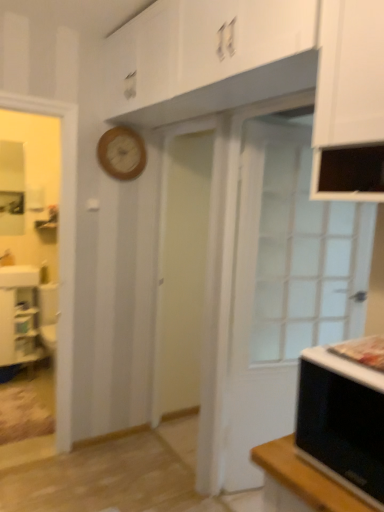
Find the location of `white glass door at right`. white glass door at right is located at coordinates (x=286, y=284).

Describe the element at coordinates (19, 326) in the screenshot. I see `white glossy cabinet at lower left` at that location.

You are a GUI agent. You are given a task and a screenshot of the screen. Output one action in this format:
    pyautogui.click(x=<x>, y=<y>)
    Task: Click on the white glass door at right
    
    Given the screenshot: What is the action you would take?
    pyautogui.click(x=286, y=284)

Based on the photo, between white glossy cabinet at lower left and wooden clock at upper center, which one has less height?

Standing shorter between the two is wooden clock at upper center.

From the image's perspective, does white glossy cabinet at lower left appear lower than wooden clock at upper center?

Yes.

Which object is closer to the camera taking this photo, white glossy cabinet at lower left or wooden clock at upper center?

wooden clock at upper center is in front.

Find the location of `door lying on the right of wooden clock at upper center`. door lying on the right of wooden clock at upper center is located at coordinates (286, 284).

Is white glass door at right positioned far away from wooden clock at upper center?

Yes.

From the image's perspective, is white glass door at right above or below wooden clock at upper center?

white glass door at right is situated lower than wooden clock at upper center in the image.

Considering the sizes of objects white glass door at right and wooden clock at upper center in the image provided, who is shorter, white glass door at right or wooden clock at upper center?

With less height is wooden clock at upper center.

Can you confirm if black matte microwave oven at lower right is smaller than wooden clock at upper center?

No, black matte microwave oven at lower right is not smaller than wooden clock at upper center.

Considering their positions, is black matte microwave oven at lower right located in front of or behind wooden clock at upper center?

In the image, black matte microwave oven at lower right appears in front of wooden clock at upper center.

Would you consider black matte microwave oven at lower right to be distant from wooden clock at upper center?

Indeed, black matte microwave oven at lower right is not near wooden clock at upper center.

From the image's perspective, which object appears higher, black matte microwave oven at lower right or wooden clock at upper center?

wooden clock at upper center, from the image's perspective.

Is white glass door at right positioned in front of white glossy cabinet at lower left?

Yes, white glass door at right is closer to the camera.

Is point (308, 152) positioned before point (25, 353)?

Yes.

You are a GUI agent. You are given a task and a screenshot of the screen. Output one action in this format:
    pyautogui.click(x=<x>, y=<y>)
    Task: Click on the door in front of the white glossy cabinet at lower left
    This screenshot has height=512, width=384.
    Given the screenshot: What is the action you would take?
    pyautogui.click(x=286, y=284)

Is white glass door at right placed right next to white glossy cabinet at lower left?

No, white glass door at right is not beside white glossy cabinet at lower left.

Does black matte microwave oven at lower right have a smaller size compared to white glossy cabinet at lower left?

Indeed, black matte microwave oven at lower right has a smaller size compared to white glossy cabinet at lower left.

The height and width of the screenshot is (512, 384). Find the location of `cabinetry that is under the black matte microwave oven at lower right (from a real-world perspective)`. cabinetry that is under the black matte microwave oven at lower right (from a real-world perspective) is located at coordinates (19, 326).

Considering the sizes of black matte microwave oven at lower right and white glossy cabinet at lower left in the image, is black matte microwave oven at lower right taller or shorter than white glossy cabinet at lower left?

Considering their sizes, black matte microwave oven at lower right has less height than white glossy cabinet at lower left.

From the image's perspective, would you say black matte microwave oven at lower right is shown under white glossy cabinet at lower left?

Actually, black matte microwave oven at lower right appears above white glossy cabinet at lower left in the image.

Does point (136, 135) come farther from viewer compared to point (323, 355)?

Yes, point (136, 135) is farther from viewer.

From a real-world perspective, which is physically below, wooden clock at upper center or black matte microwave oven at lower right?

black matte microwave oven at lower right is physically lower.

Which object is further away from the camera taking this photo, wooden clock at upper center or black matte microwave oven at lower right?

wooden clock at upper center is further away from the camera.

Locate an element on the screen. The height and width of the screenshot is (512, 384). cabinetry below the wooden clock at upper center (from the image's perspective) is located at coordinates (19, 326).

Is white glossy cabinet at lower left at the back of wooden clock at upper center?

wooden clock at upper center is not turned away from white glossy cabinet at lower left.

Who is taller, wooden clock at upper center or white glossy cabinet at lower left?

With more height is white glossy cabinet at lower left.

This screenshot has width=384, height=512. What are the coordinates of `cabinetry behind the wooden clock at upper center` in the screenshot? It's located at (x=19, y=326).

At what (x,y) coordinates should I click in order to perform the action: click on door that appears below the wooden clock at upper center (from the image's perspective). Please return your answer as a coordinate pair (x, y). The image size is (384, 512). Looking at the image, I should click on (286, 284).

When comparing their distances from white glossy cabinet at lower left, does wooden clock at upper center or black matte microwave oven at lower right seem closer?

wooden clock at upper center lies closer to white glossy cabinet at lower left than the other object.

From the image, which object appears to be nearer to wooden clock at upper center, black matte microwave oven at lower right or white glossy cabinet at lower left?

white glossy cabinet at lower left.

From the picture: Looking at the image, which one is located further to black matte microwave oven at lower right, white glossy cabinet at lower left or white glass door at right?

white glossy cabinet at lower left lies further to black matte microwave oven at lower right than the other object.

Considering their positions, is white glossy cabinet at lower left positioned further to black matte microwave oven at lower right than wooden clock at upper center?

white glossy cabinet at lower left is positioned further to the anchor black matte microwave oven at lower right.

Considering their positions, is wooden clock at upper center positioned closer to white glass door at right than black matte microwave oven at lower right?

wooden clock at upper center is positioned closer to the anchor white glass door at right.

Estimate the real-world distances between objects in this image. Which object is further from white glass door at right, black matte microwave oven at lower right or wooden clock at upper center?

Among the two, black matte microwave oven at lower right is located further to white glass door at right.

When comparing their distances from wooden clock at upper center, does white glossy cabinet at lower left or black matte microwave oven at lower right seem closer?

white glossy cabinet at lower left lies closer to wooden clock at upper center than the other object.

Considering their positions, is white glass door at right positioned closer to black matte microwave oven at lower right than wooden clock at upper center?

The object closer to black matte microwave oven at lower right is white glass door at right.

Find the location of a particular element. Image resolution: width=384 pixels, height=512 pixels. clock between white glossy cabinet at lower left and white glass door at right in the horizontal direction is located at coordinates (122, 153).

Locate an element on the screen. This screenshot has width=384, height=512. clock located between black matte microwave oven at lower right and white glossy cabinet at lower left in the depth direction is located at coordinates (122, 153).

The height and width of the screenshot is (512, 384). I want to click on door located between black matte microwave oven at lower right and wooden clock at upper center in the depth direction, so coord(286,284).

I want to click on door between black matte microwave oven at lower right and white glossy cabinet at lower left from front to back, so click(286, 284).